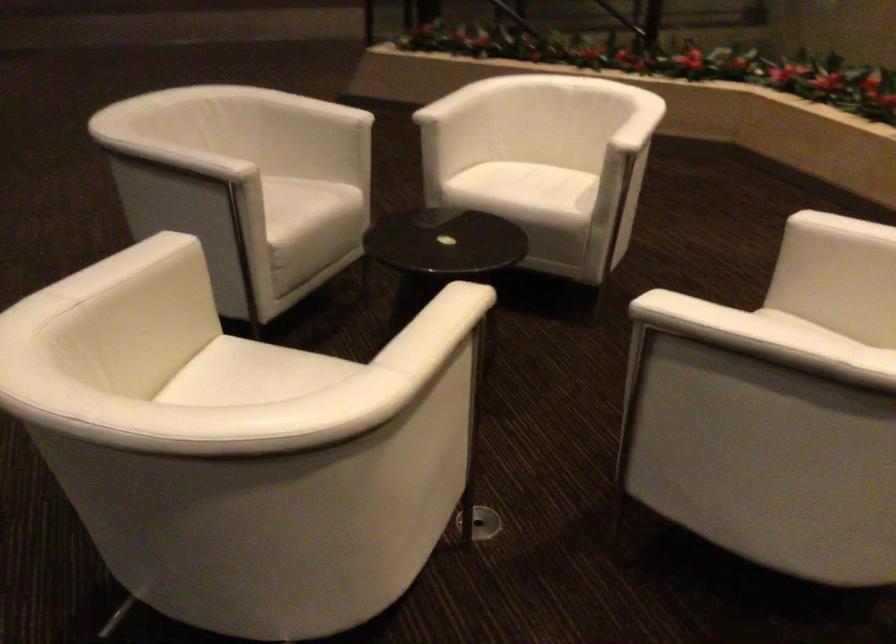
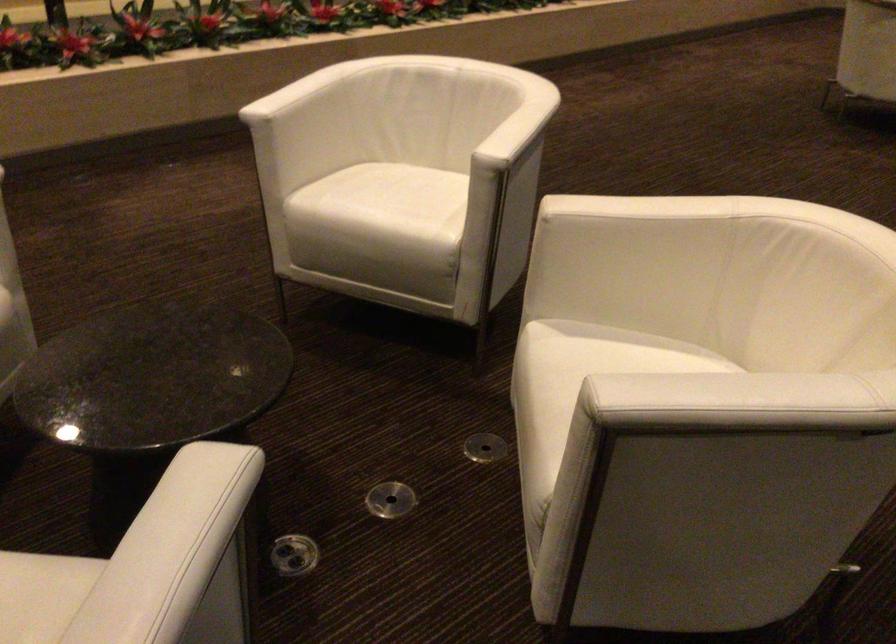
Where in the second image is the point corresponding to [426,234] from the first image?

(152, 377)